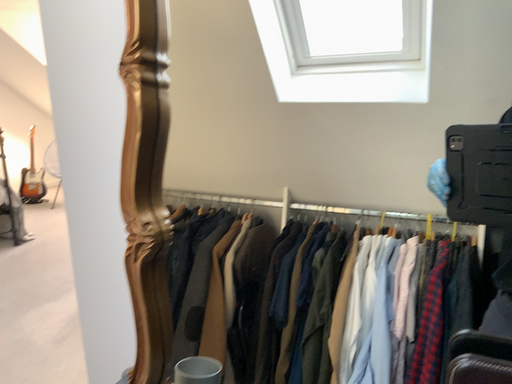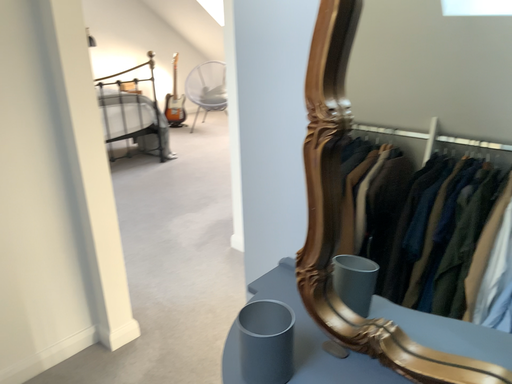
Question: How did the camera likely rotate when shooting the video?

Choices:
 (A) rotated right
 (B) rotated left

Answer: (B)